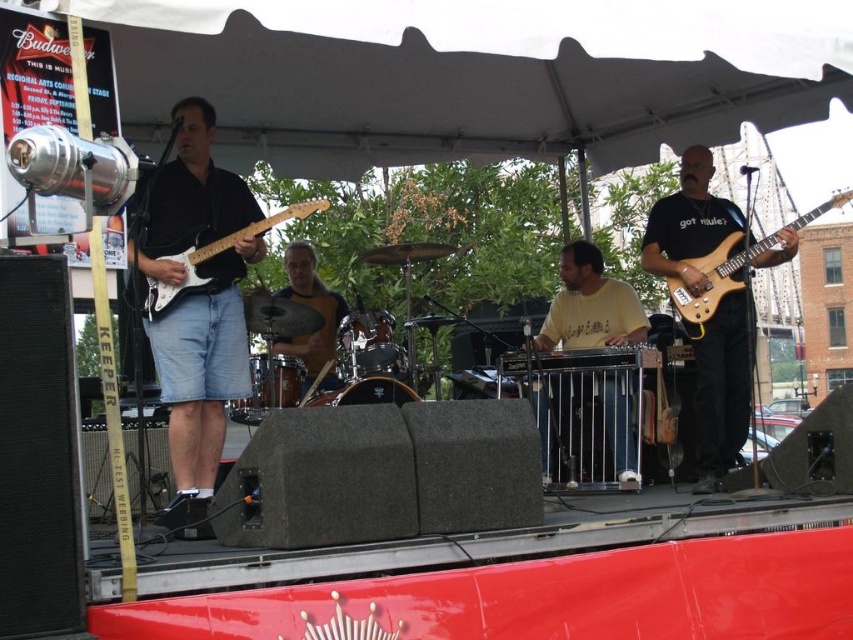
Based on the scene description, which object is positioned lower in the image, the yellow fabric shirt at center or the light brown wood electric guitar at right?

The yellow fabric shirt at center is located below the light brown wood electric guitar at right, so it is positioned lower in the image.